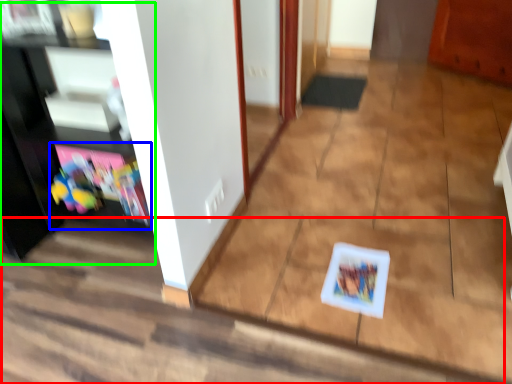
Question: Considering the real-world distances, which object is farthest from stair (highlighted by a red box)? shelf (highlighted by a blue box) or entertainment center (highlighted by a green box)?

Choices:
 (A) shelf
 (B) entertainment center

Answer: (B)